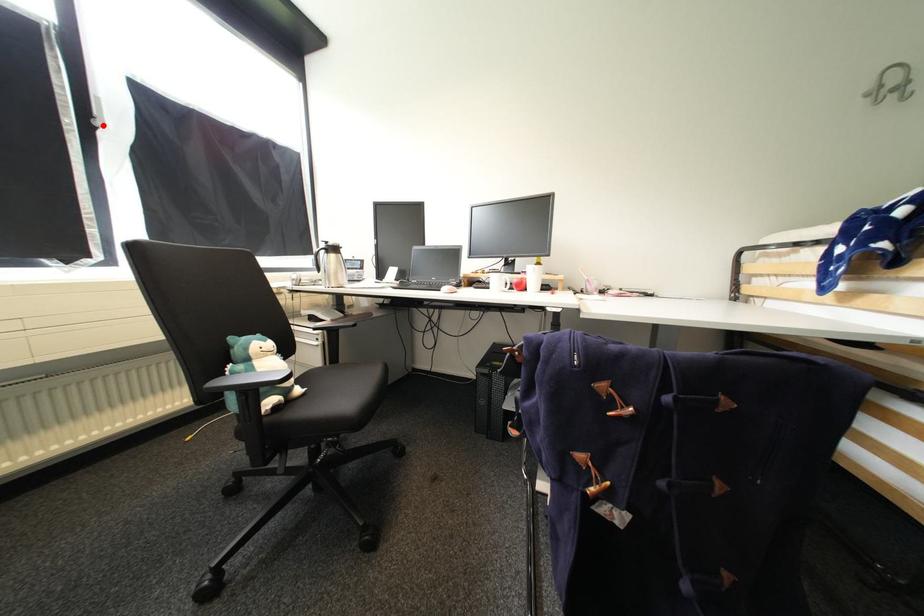
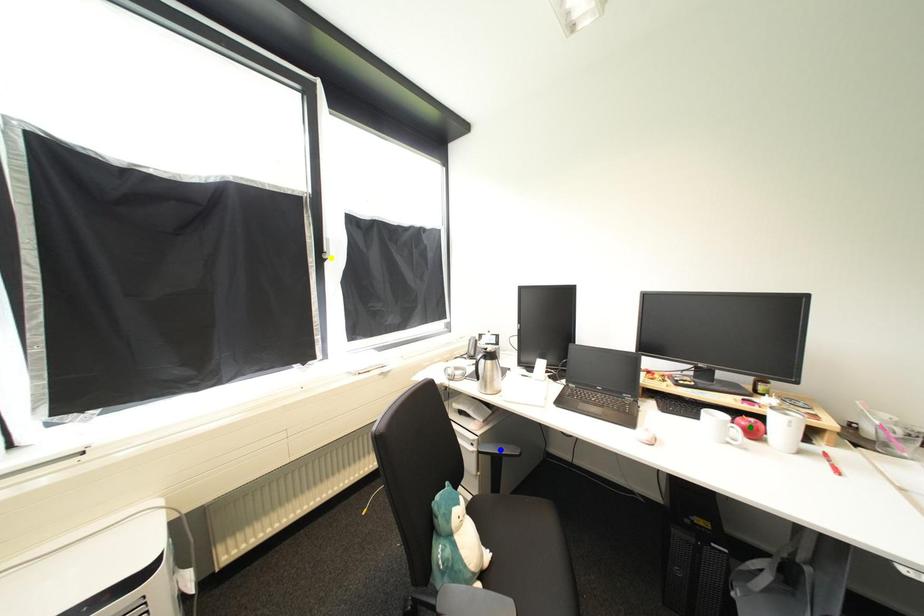
Question: I am providing you with two images of the same scene from different viewpoints. A red point is marked on the first image. You are given multiple points on the second image. Which point in image 2 is actually the same real-world point as the red point in image 1?

Choices:
 (A) blue point
 (B) green point
 (C) yellow point

Answer: (C)